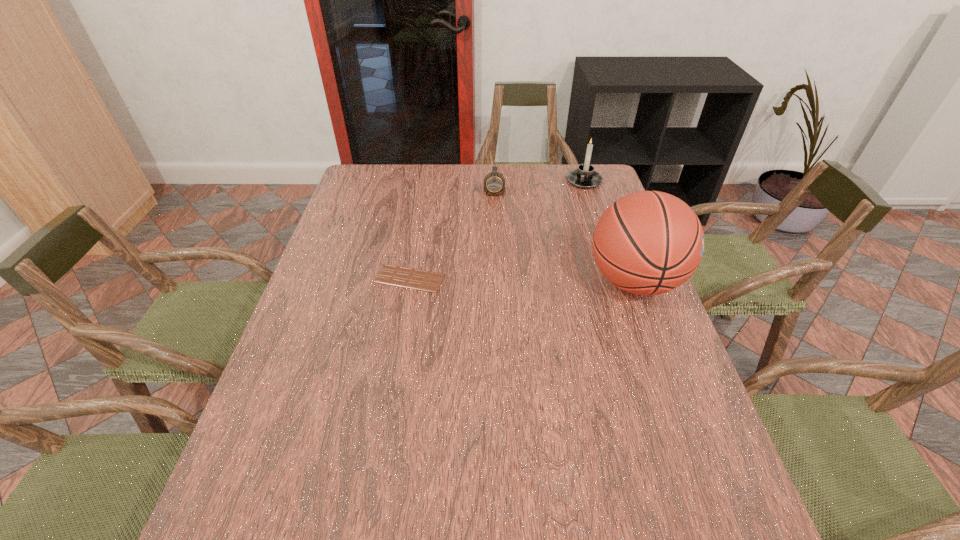
In order to click on vacant point located 0.290m on the face of the third tallest object in this screenshot , I will do `click(493, 253)`.

Identify the location of free location located on the face of the third tallest object. (493, 236).

Where is `free location located 0.250m on the face of the third tallest object`? The width and height of the screenshot is (960, 540). free location located 0.250m on the face of the third tallest object is located at coordinates (493, 244).

The width and height of the screenshot is (960, 540). Find the location of `candle holder that is at the far edge`. candle holder that is at the far edge is located at coordinates (585, 177).

Identify the location of compass situated at the far edge. This screenshot has height=540, width=960. (494, 183).

Locate an element on the screen. basketball at the right edge is located at coordinates (649, 242).

The height and width of the screenshot is (540, 960). I want to click on candle holder that is at the right edge, so click(x=585, y=177).

You are a GUI agent. You are given a task and a screenshot of the screen. Output one action in this format:
    pyautogui.click(x=<x>, y=<y>)
    Task: Click on the object that is at the far right corner
    The height and width of the screenshot is (540, 960).
    Given the screenshot: What is the action you would take?
    pyautogui.click(x=585, y=177)

Locate an element on the screen. The width and height of the screenshot is (960, 540). free space at the far edge of the desktop is located at coordinates (515, 198).

At what (x,y) coordinates should I click in order to perform the action: click on vacant space at the left edge of the desktop. Please return your answer as a coordinate pair (x, y). Looking at the image, I should click on (326, 440).